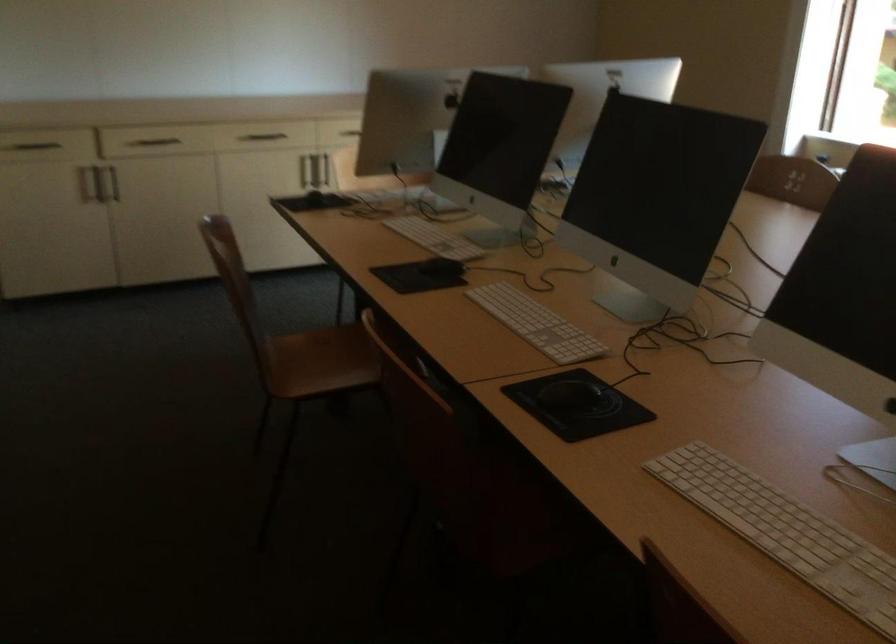
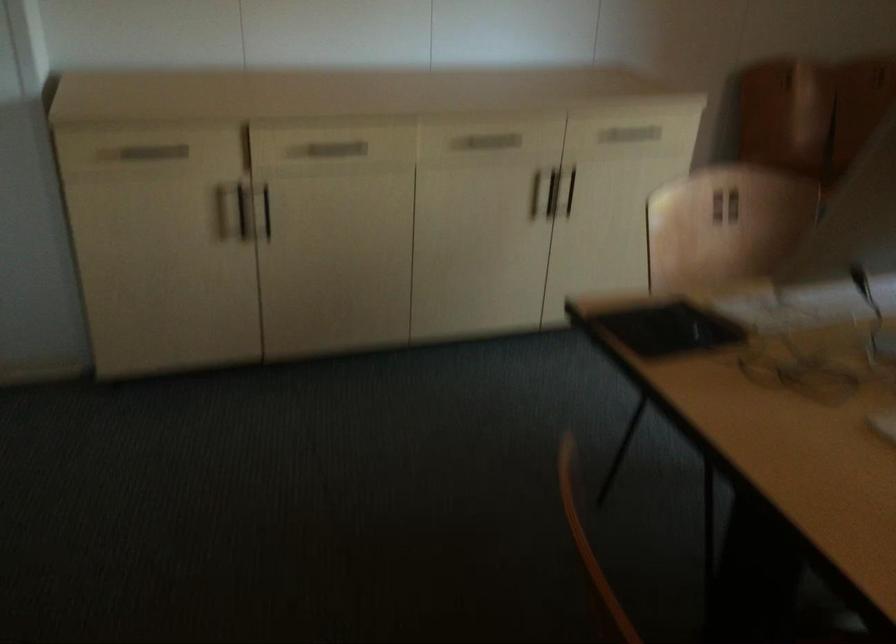
Find the pixel in the second image that matches pixel 323 171 in the first image.

(570, 192)